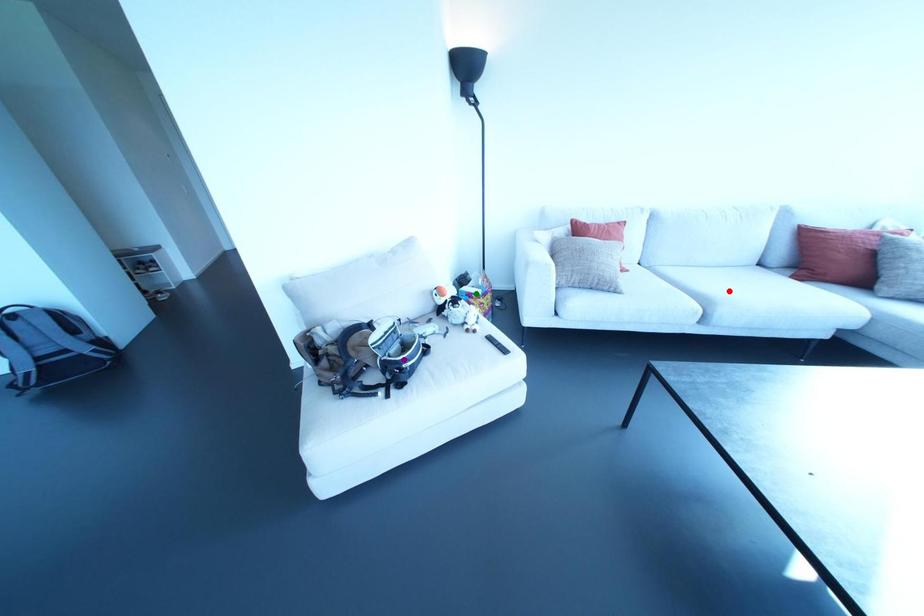
Order these from farthest to nearest:
- red point
- green point
- purple point

1. green point
2. red point
3. purple point